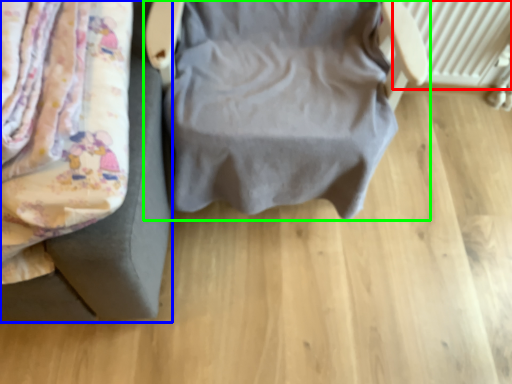
Question: Which object is the farthest from radiator (highlighted by a red box)? Choose among these: furniture (highlighted by a blue box) or furniture (highlighted by a green box).

Choices:
 (A) furniture
 (B) furniture

Answer: (A)